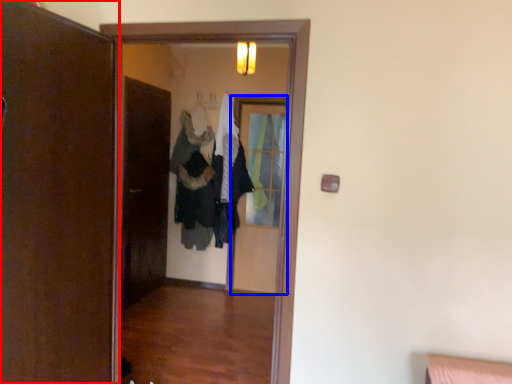
Question: Which point is further to the camera, door (highlighted by a red box) or screen door (highlighted by a blue box)?

Choices:
 (A) door
 (B) screen door

Answer: (B)